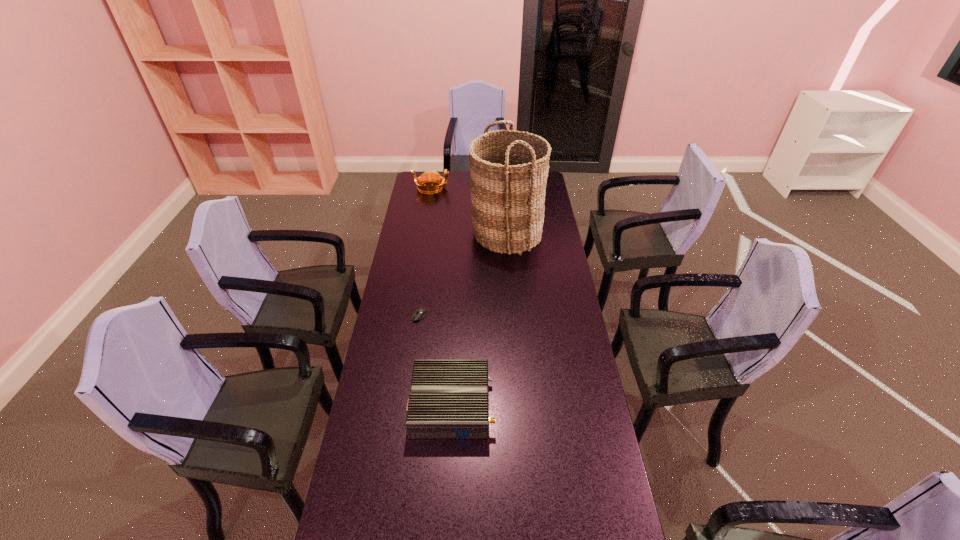
Find the location of a particular element. Image resolution: width=960 pixels, height=540 pixels. vacant space that satisfies the following two spatial constraints: 1. at the front emblem of the tallest object; 2. on the left side of the farthest object is located at coordinates (424, 233).

Identify the location of vacant space that satisfies the following two spatial constraints: 1. at the front emblem of the third shortest object; 2. on the left side of the tallest object. coord(424,233).

This screenshot has width=960, height=540. What are the coordinates of `free location that satisfies the following two spatial constraints: 1. at the front emblem of the second nearest object; 2. on the left side of the farthest object` in the screenshot? It's located at (411, 316).